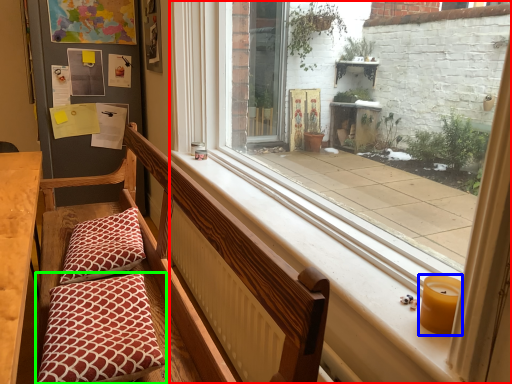
Question: Based on their relative distances, which object is farther from window (highlighted by a red box)? Choose from candle holder (highlighted by a blue box) and pillow (highlighted by a green box).

Choices:
 (A) candle holder
 (B) pillow

Answer: (B)